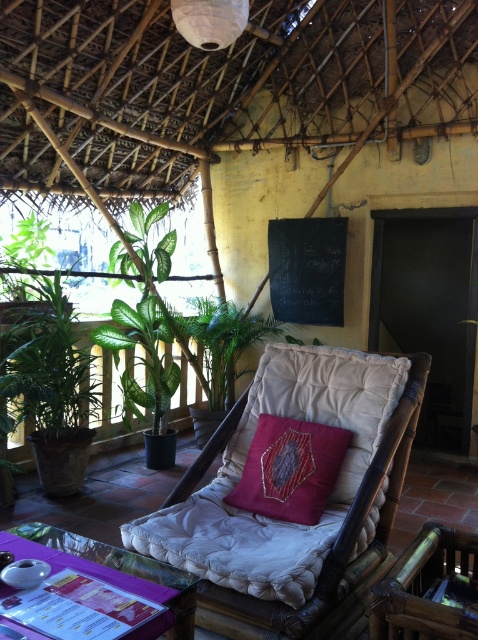
You are standing in the room and want to sit on the embroidered velvet cushion at center. Where should you look to find it?

The embroidered velvet cushion at center is located at point (290, 468).

Looking at this image, you are planning to place a large plant pot that requires a surface area of 1.2 square meters. Given the embroidered velvet cushion at center and the transparent glass table at lower center, which object can accommodate the plant pot based on their sizes?

The embroidered velvet cushion at center is larger in size than the transparent glass table at lower center, so the embroidered velvet cushion at center can accommodate the plant pot as it has a bigger surface area.